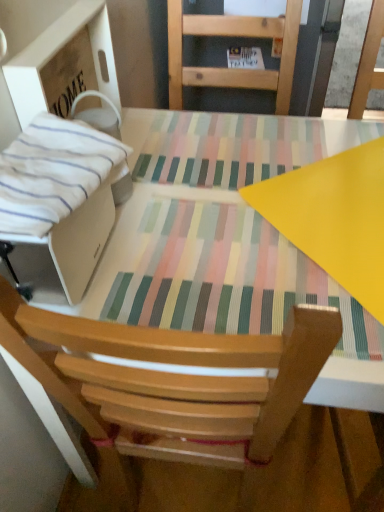
This screenshot has height=512, width=384. Identify the location of free space above matte plastic table at center (from a real-world perspective). (239, 197).